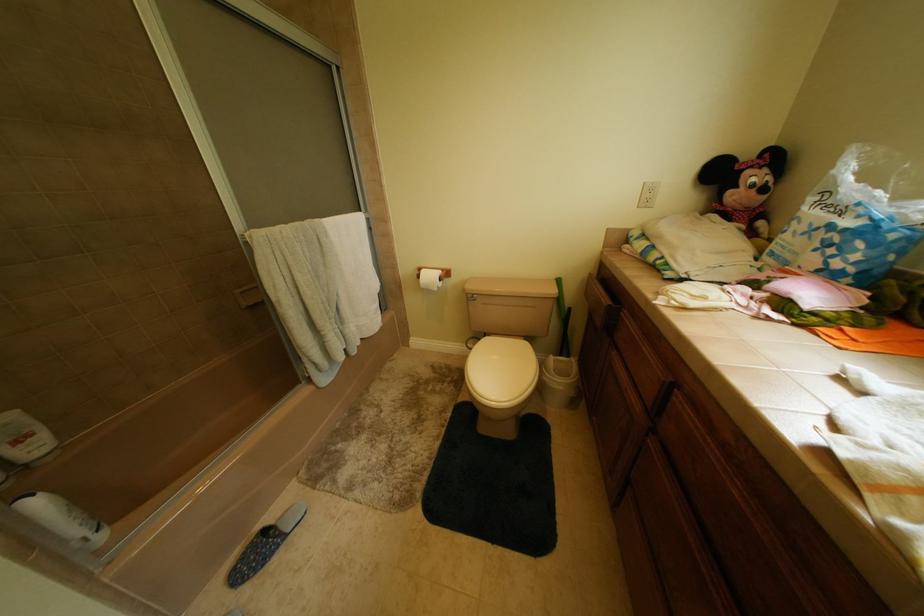
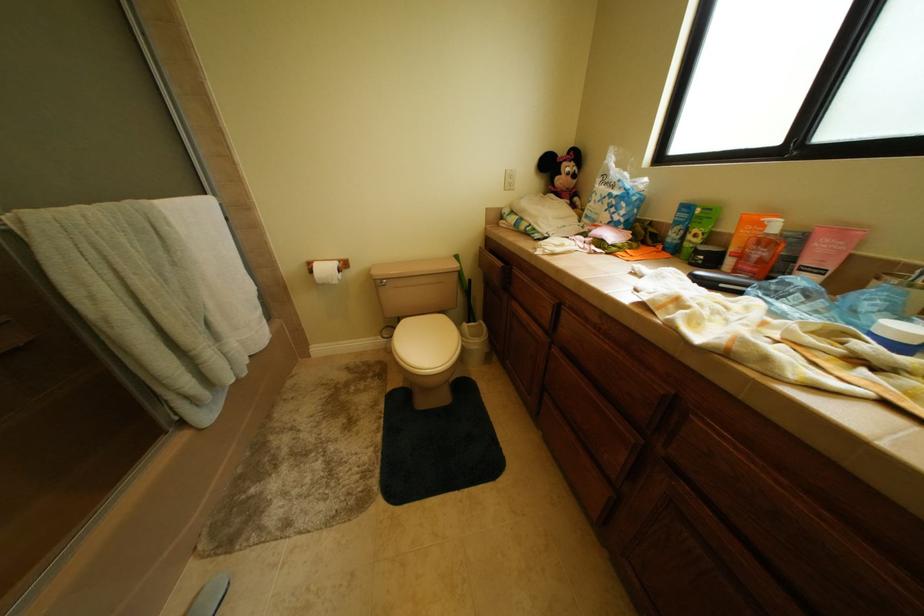
Question: In a continuous first-person perspective shot, in which direction is the camera moving?

Choices:
 (A) Left
 (B) Right
 (C) Forward
 (D) Backward

Answer: (A)